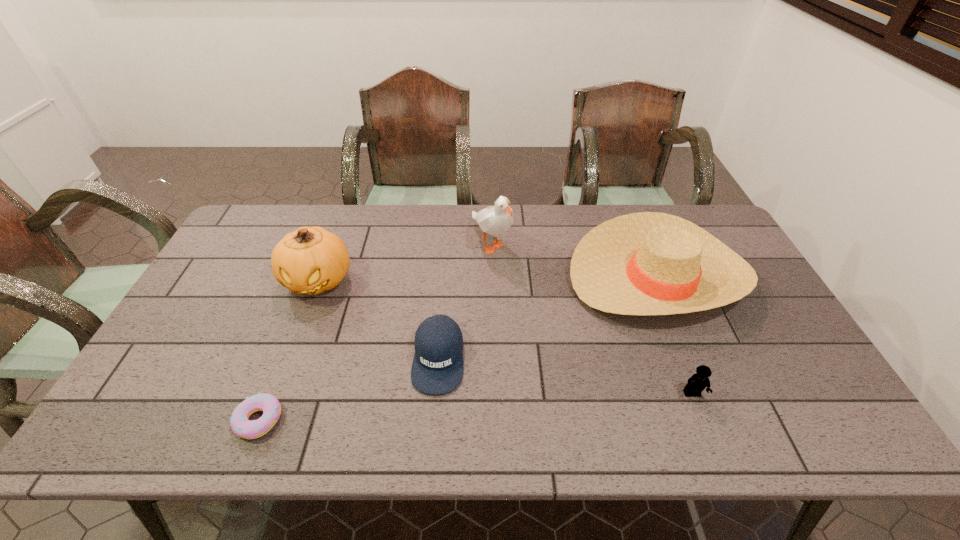
At what (x,y) coordinates should I click in order to perform the action: click on gull. Please return your answer as a coordinate pair (x, y). The height and width of the screenshot is (540, 960). Looking at the image, I should click on (495, 221).

The image size is (960, 540). What are the coordinates of `pumpkin` in the screenshot? It's located at (311, 260).

You are a GUI agent. You are given a task and a screenshot of the screen. Output one action in this format:
    pyautogui.click(x=<x>, y=<y>)
    Task: Click on the fourth shortest object
    
    Given the screenshot: What is the action you would take?
    pyautogui.click(x=648, y=263)

This screenshot has width=960, height=540. In order to click on Lego in this screenshot , I will do `click(698, 382)`.

Locate an element on the screen. baseball cap is located at coordinates click(x=437, y=368).

Where is `the fifth tallest object`? The image size is (960, 540). the fifth tallest object is located at coordinates (437, 368).

Image resolution: width=960 pixels, height=540 pixels. I want to click on doughnut, so click(269, 404).

Identify the location of blank space located 0.240m at the beak of the gull. (493, 328).

The width and height of the screenshot is (960, 540). In order to click on vacant space located on the front face of the pumpkin in this screenshot , I will do `click(281, 379)`.

The width and height of the screenshot is (960, 540). I want to click on vacant space located 0.190m on the left of the third tallest object, so click(505, 275).